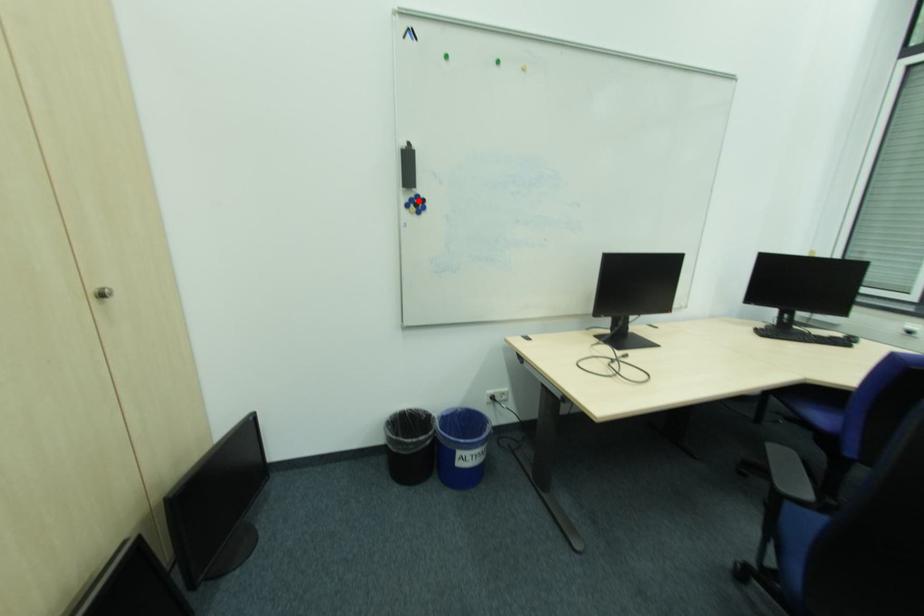
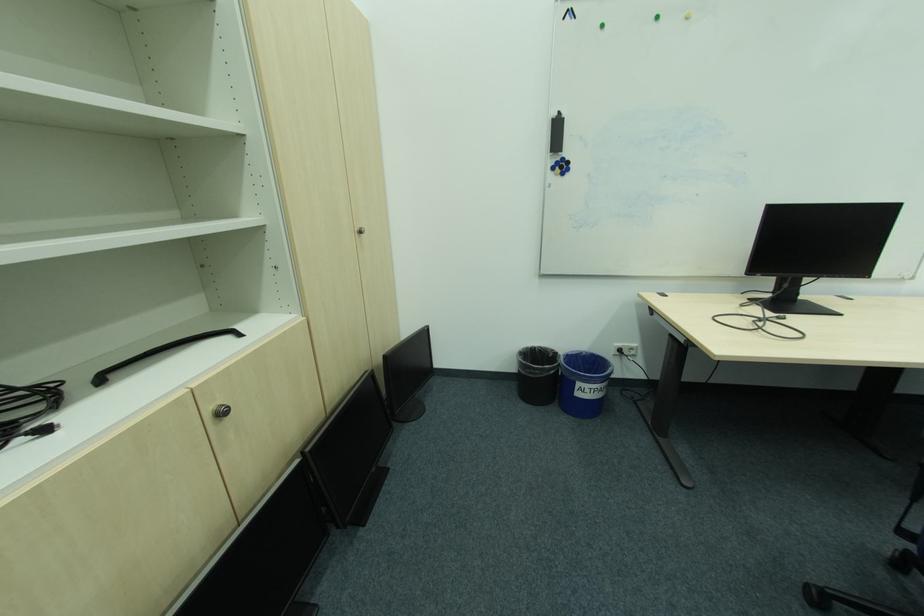
The point at the highlighted location is marked in the first image. Where is the corresponding point in the second image?

(565, 163)